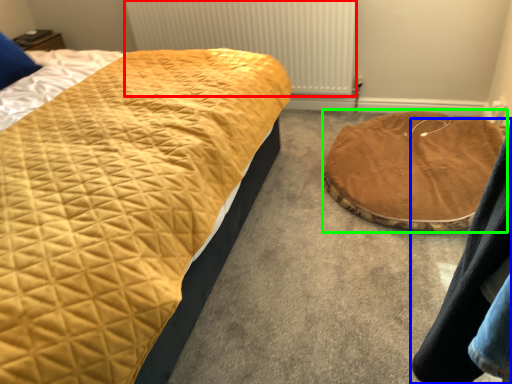
Question: Which object is the closest to the radiator (highlighted by a red box)? Choose among these: couple (highlighted by a blue box) or cat bed (highlighted by a green box).

Choices:
 (A) couple
 (B) cat bed

Answer: (B)